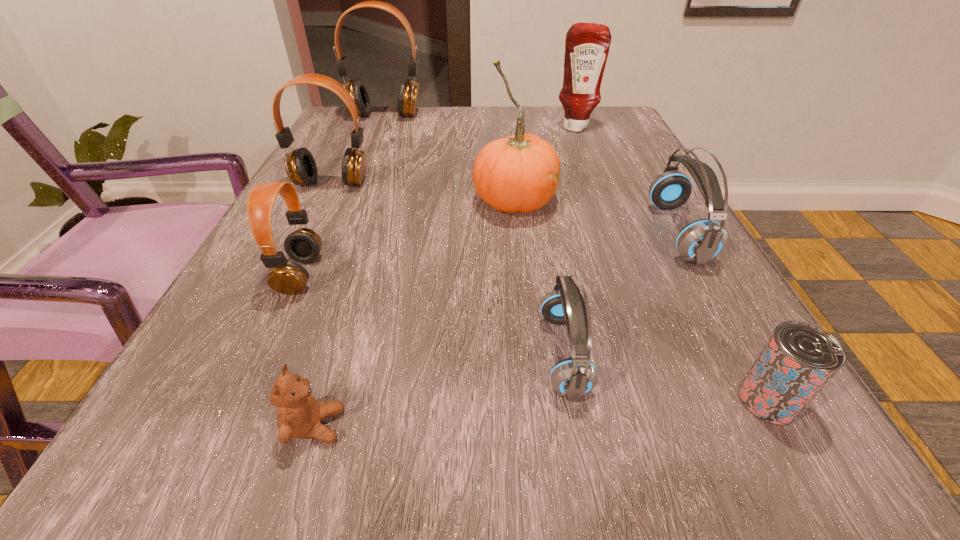
Where is `free location that satisfies the following two spatial constraints: 1. on the ear cups of the farthest headset; 2. on the left side of the red beer can`? This screenshot has width=960, height=540. free location that satisfies the following two spatial constraints: 1. on the ear cups of the farthest headset; 2. on the left side of the red beer can is located at coordinates (271, 400).